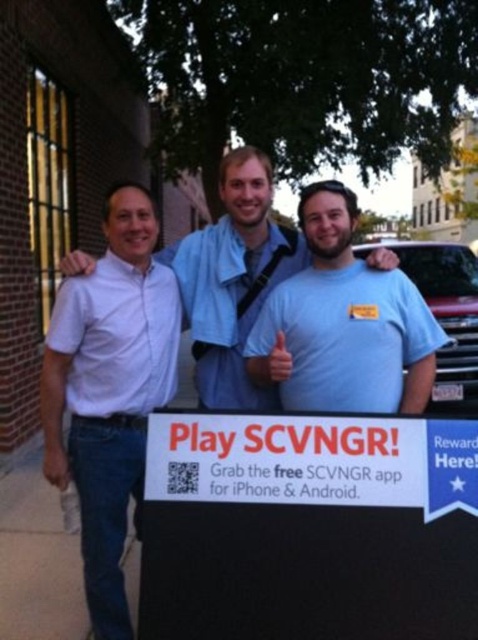
Does white shirt at left come behind light blue t-shirt at center?

Yes, it is behind light blue t-shirt at center.

The width and height of the screenshot is (478, 640). Identify the location of white shirt at left. (109, 390).

Who is positioned more to the right, white paper sign at lower center or light blue t-shirt at center?

Positioned to the right is light blue t-shirt at center.

Is white paper sign at lower center positioned behind light blue t-shirt at center?

No, it is not.

The width and height of the screenshot is (478, 640). Describe the element at coordinates (315, 460) in the screenshot. I see `white paper sign at lower center` at that location.

At what (x,y) coordinates should I click in order to perform the action: click on white paper sign at lower center. Please return your answer as a coordinate pair (x, y). The height and width of the screenshot is (640, 478). Looking at the image, I should click on (315, 460).

Is white shirt at left above white paper sign at lower center?

Indeed, white shirt at left is positioned over white paper sign at lower center.

The image size is (478, 640). Identify the location of white shirt at left. (109, 390).